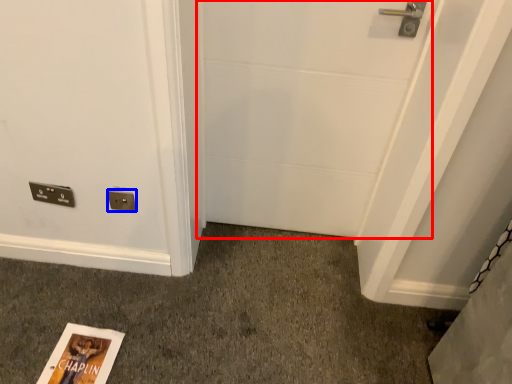
Question: Which object is closer to the camera taking this photo, door (highlighted by a red box) or electric outlet (highlighted by a blue box)?

Choices:
 (A) door
 (B) electric outlet

Answer: (A)